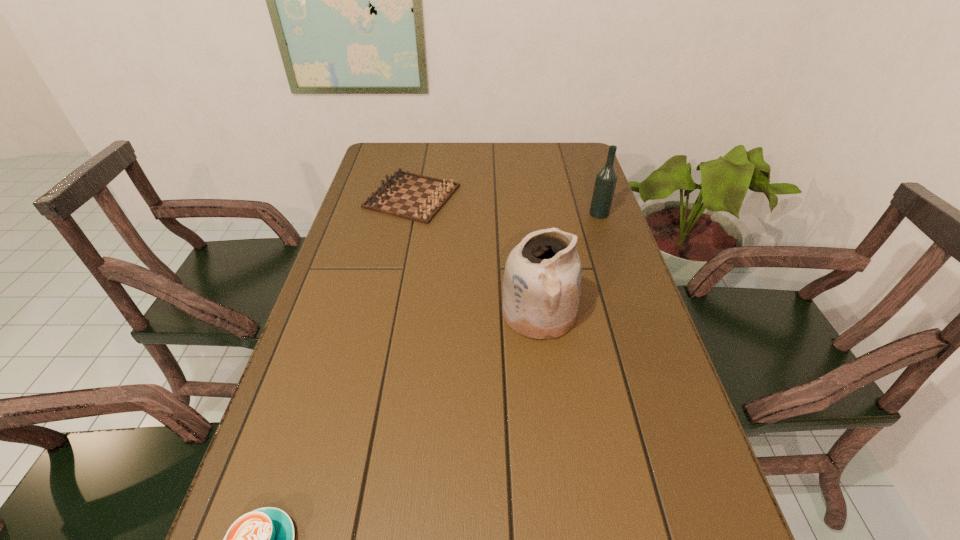
Locate an element on the screen. This screenshot has height=540, width=960. the third closest object to the chessboard is located at coordinates (263, 539).

Locate an element on the screen. The image size is (960, 540). object that is the closest one to the chessboard is located at coordinates (542, 280).

In order to click on vacant point that satisfies the following two spatial constraints: 1. on the front side of the chessboard; 2. on the right side of the second nearest object in this screenshot , I will do `click(389, 313)`.